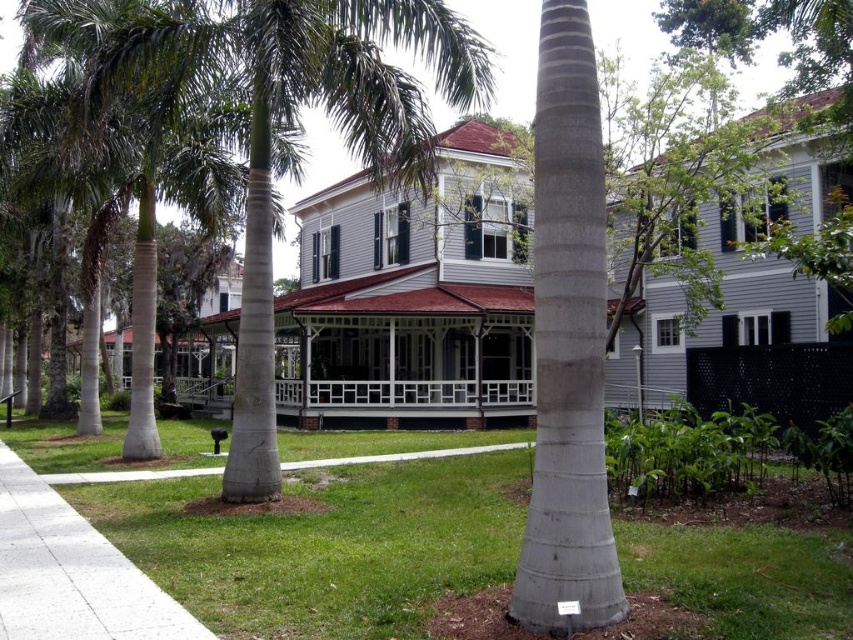
Can you confirm if green grass at center is shorter than gray textured palm tree trunk at center?

Indeed, green grass at center has a lesser height compared to gray textured palm tree trunk at center.

Is green grass at center behind gray textured palm tree trunk at center?

No, green grass at center is closer to the viewer.

Is point (363, 433) in front of point (546, 49)?

No, (363, 433) is further to viewer.

Locate an element on the screen. green grass at center is located at coordinates (325, 545).

Is green grass at center shorter than concrete at center?

Incorrect, green grass at center's height does not fall short of concrete at center's.

Between green grass at center and concrete at center, which one appears on the right side from the viewer's perspective?

From the viewer's perspective, green grass at center appears more on the right side.

Which is in front, point (260, 609) or point (33, 532)?

Point (260, 609) is more forward.

You are a GUI agent. You are given a task and a screenshot of the screen. Output one action in this format:
    pyautogui.click(x=<x>, y=<y>)
    Task: Click on the green grass at center
    The height and width of the screenshot is (640, 853).
    Given the screenshot: What is the action you would take?
    pyautogui.click(x=325, y=545)

Can you confirm if green leafy palm tree at center is wider than gray textured palm tree trunk at center?

Yes, green leafy palm tree at center is wider than gray textured palm tree trunk at center.

Between point (339, 56) and point (520, 573), which one is positioned behind?

Point (339, 56)

Where is `green leafy palm tree at center`? green leafy palm tree at center is located at coordinates (271, 120).